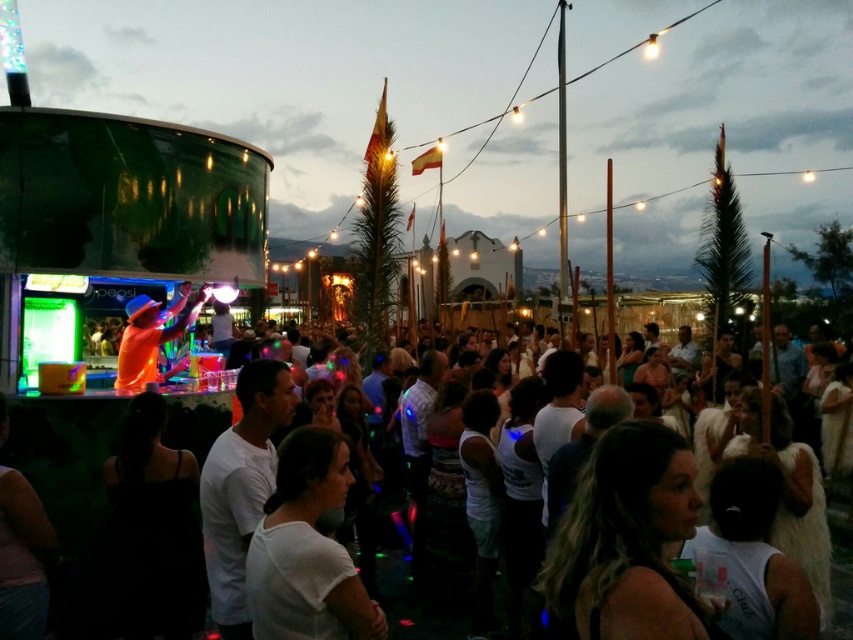
You are at a party and want to find the DJ. You see a white matte shirt at center and an orange fabric dj at center. Which one is closer to the DJ?

The orange fabric dj at center is the DJ themselves, so they are closest to the DJ.